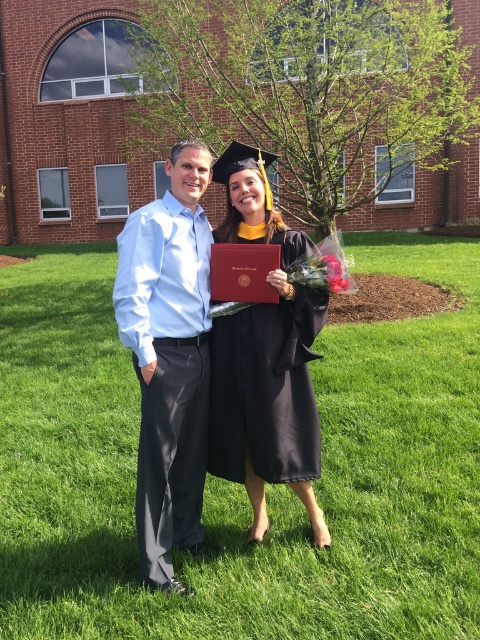
Between point (212, 432) and point (200, 282), which one is positioned behind?

The point (212, 432) is behind.

Is point (255, 326) positioned in front of point (139, 541)?

No.

Image resolution: width=480 pixels, height=640 pixels. Identify the location of matte black gown at center. (207, 374).

Does light blue shirt at center have a greater width compared to black matte graduation gown at center?

Incorrect, light blue shirt at center's width does not surpass black matte graduation gown at center's.

Is point (183, 356) farther from viewer compared to point (226, 237)?

No, (183, 356) is in front of (226, 237).

In order to click on light blue shirt at center in this screenshot , I will do click(168, 356).

Can you confirm if green grass at center is bigger than matte black gown at center?

Yes.

Measure the distance between green grass at center and matte black gown at center.

A distance of 5.40 feet exists between green grass at center and matte black gown at center.

The height and width of the screenshot is (640, 480). Describe the element at coordinates (240, 484) in the screenshot. I see `green grass at center` at that location.

Identify the location of green grass at center. (240, 484).